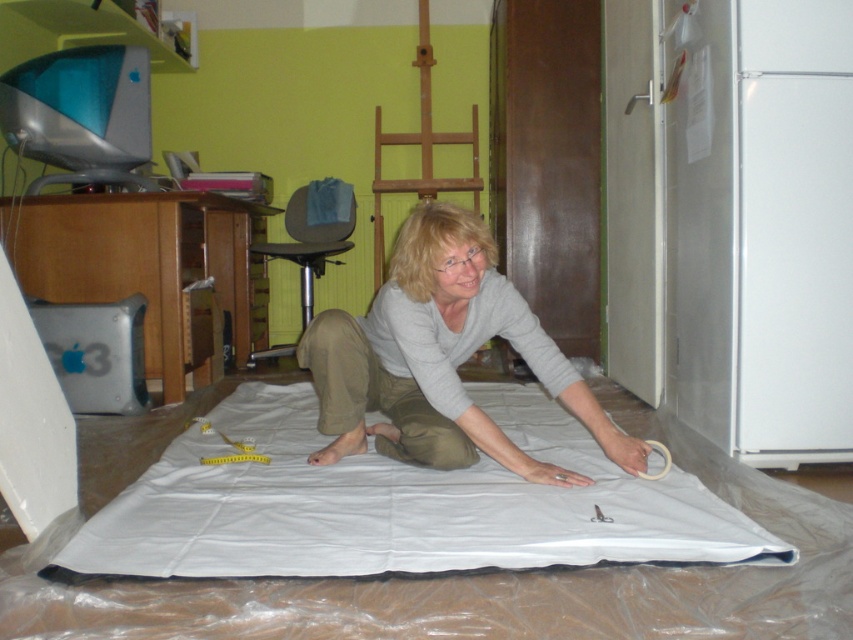
Question: Which point appears farthest from the camera in this image?

Choices:
 (A) (409, 339)
 (B) (520, 404)

Answer: (B)

Question: Is white fabric at center further to the viewer compared to gray cotton shirt at center?

Choices:
 (A) yes
 (B) no

Answer: (B)

Question: Considering the relative positions of white fabric at center and gray cotton shirt at center in the image provided, where is white fabric at center located with respect to gray cotton shirt at center?

Choices:
 (A) above
 (B) below

Answer: (B)

Question: Does white fabric at center have a greater width compared to gray cotton shirt at center?

Choices:
 (A) yes
 (B) no

Answer: (A)

Question: Which of the following is the closest to the observer?

Choices:
 (A) white fabric at center
 (B) gray cotton shirt at center

Answer: (A)